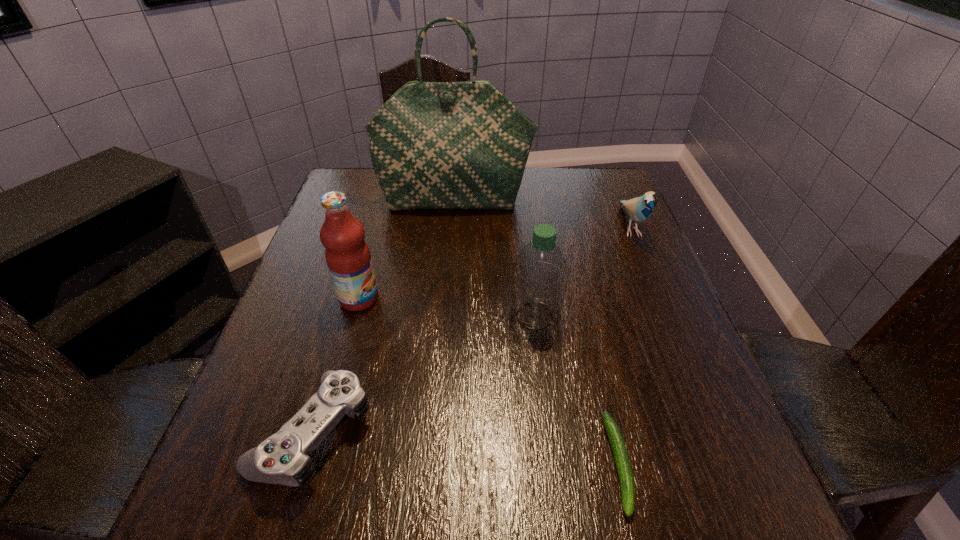
At what (x,y) coordinates should I click in order to perform the action: click on vacant area in the image that satisfies the following two spatial constraints: 1. on the front side of the tote bag; 2. on the front label of the fruit juice. Please return your answer as a coordinate pair (x, y). The image size is (960, 540). Looking at the image, I should click on (447, 298).